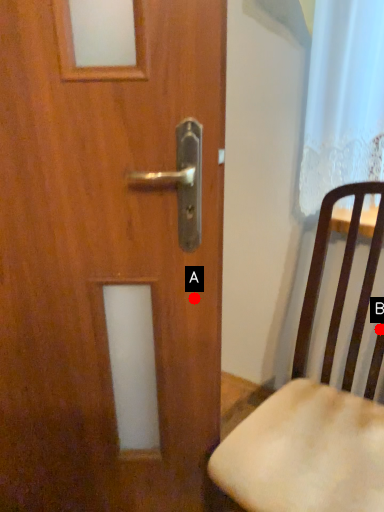
Question: Two points are circled on the image, labeled by A and B beside each circle. Which point is closer to the camera?

Choices:
 (A) A is closer
 (B) B is closer

Answer: (A)